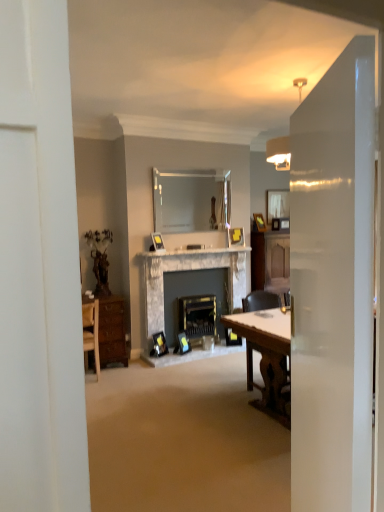
Question: Is matte silver picture frame at center, marked as the 3th picture frame in a top-to-bottom arrangement, not within clear glass mirror at upper center, which is counted as the second mirror, starting from the right?

Choices:
 (A) yes
 (B) no

Answer: (A)

Question: Can you confirm if matte silver picture frame at center, the 3th picture frame from the bottom, is smaller than clear glass mirror at upper center, positioned as the 2th mirror in back-to-front order?

Choices:
 (A) no
 (B) yes

Answer: (B)

Question: Does matte silver picture frame at center, the first picture frame in the left-to-right sequence, have a lesser height compared to clear glass mirror at upper center, positioned as the 2th mirror in back-to-front order?

Choices:
 (A) yes
 (B) no

Answer: (A)

Question: From a real-world perspective, does matte silver picture frame at center, which ranks as the fifth picture frame in right-to-left order, sit lower than clear glass mirror at upper center, which is counted as the second mirror, starting from the right?

Choices:
 (A) no
 (B) yes

Answer: (B)

Question: From the image's perspective, is matte silver picture frame at center, the first picture frame in the left-to-right sequence, below clear glass mirror at upper center, positioned as the 2th mirror in back-to-front order?

Choices:
 (A) yes
 (B) no

Answer: (A)

Question: Is wooden table at right wider or thinner than wooden chair at right?

Choices:
 (A) thin
 (B) wide

Answer: (B)

Question: Considering the positions of wooden table at right and wooden chair at right in the image, is wooden table at right taller or shorter than wooden chair at right?

Choices:
 (A) tall
 (B) short

Answer: (B)

Question: From a real-world perspective, is wooden table at right physically located above or below wooden chair at right?

Choices:
 (A) below
 (B) above

Answer: (A)

Question: From the image's perspective, relative to wooden chair at right, is wooden table at right above or below?

Choices:
 (A) below
 (B) above

Answer: (A)

Question: Looking at their shapes, would you say matte glass mirror at upper center, the second mirror in the front-to-back sequence, is wider or thinner than wooden table at right?

Choices:
 (A) wide
 (B) thin

Answer: (B)

Question: Is matte glass mirror at upper center, the second mirror in the front-to-back sequence, taller or shorter than wooden table at right?

Choices:
 (A) short
 (B) tall

Answer: (A)

Question: Visually, is matte glass mirror at upper center, which is the 1th mirror in right-to-left order, positioned to the left or to the right of wooden table at right?

Choices:
 (A) right
 (B) left

Answer: (A)

Question: Is matte glass mirror at upper center, positioned as the first mirror in back-to-front order, inside the boundaries of wooden table at right, or outside?

Choices:
 (A) inside
 (B) outside

Answer: (B)

Question: Considering their positions, is transparent glass door at right located in front of or behind wooden picture frame at center, positioned as the 5th picture frame in left-to-right order?

Choices:
 (A) behind
 (B) front

Answer: (B)

Question: Is transparent glass door at right to the left or to the right of wooden picture frame at center, arranged as the 1th picture frame when viewed from the top, in the image?

Choices:
 (A) left
 (B) right

Answer: (A)